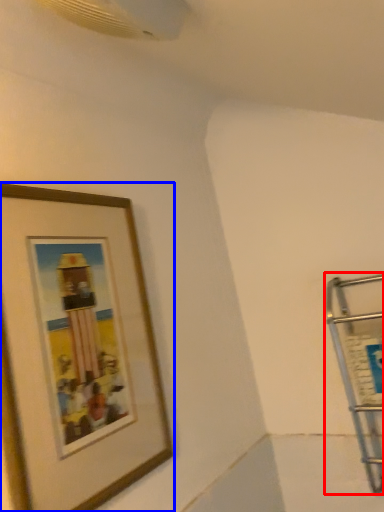
Question: Which point is further to the camera, cart (highlighted by a red box) or picture frame (highlighted by a blue box)?

Choices:
 (A) cart
 (B) picture frame

Answer: (A)